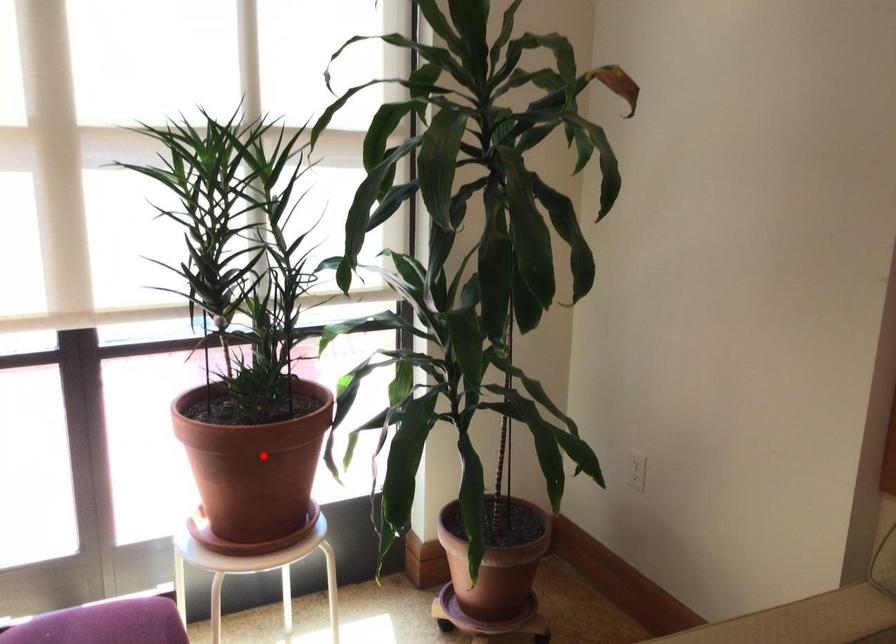
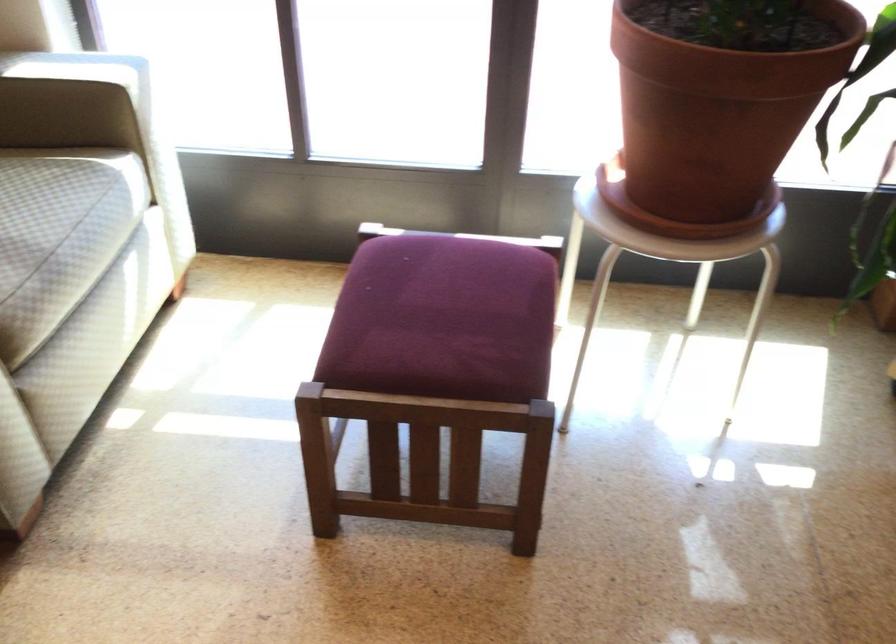
Question: I am providing you with two images of the same scene from different viewpoints. A red point is shown in image1. For the corresponding object point in image2, is it positioned nearer or farther from the camera?

Choices:
 (A) Nearer
 (B) Farther

Answer: (A)